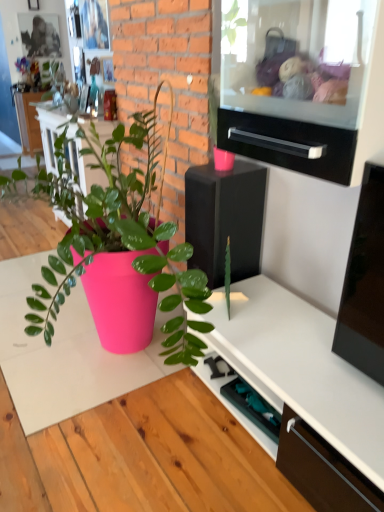
The height and width of the screenshot is (512, 384). What do you see at coordinates (225, 219) in the screenshot? I see `black glossy speaker at center` at bounding box center [225, 219].

Locate an element on the screen. black glossy speaker at center is located at coordinates (225, 219).

Describe the element at coordinates (289, 144) in the screenshot. I see `black glossy drawer at upper center` at that location.

The image size is (384, 512). What are the coordinates of `black glossy drawer at upper center` in the screenshot? It's located at (289, 144).

Identify the location of black glossy speaker at center. (225, 219).

Visually, is black glossy speaker at center positioned to the left or to the right of black glossy drawer at upper center?

black glossy speaker at center is positioned on black glossy drawer at upper center's left side.

Who is more distant, black glossy speaker at center or black glossy drawer at upper center?

black glossy speaker at center is more distant.

Is point (197, 191) closer to camera compared to point (306, 137)?

No, (197, 191) is behind (306, 137).

From the image's perspective, is black glossy speaker at center located above or below black glossy drawer at upper center?

Clearly, from the image's perspective, black glossy speaker at center is below black glossy drawer at upper center.

From a real-world perspective, is black glossy speaker at center on top of black glossy drawer at upper center?

No, from a real-world perspective, black glossy speaker at center is not on top of black glossy drawer at upper center.

Is black glossy speaker at center wider or thinner than black glossy drawer at upper center?

black glossy speaker at center is wider than black glossy drawer at upper center.

Who is taller, black glossy speaker at center or black glossy drawer at upper center?

Standing taller between the two is black glossy speaker at center.

Considering the sizes of black glossy speaker at center and black glossy drawer at upper center in the image, is black glossy speaker at center bigger or smaller than black glossy drawer at upper center?

In the image, black glossy speaker at center appears to be larger than black glossy drawer at upper center.

Is black glossy drawer at upper center a part of black glossy speaker at center?

No.

Are black glossy speaker at center and black glossy drawer at upper center making contact?

They are not placed beside each other.

Does black glossy speaker at center turn towards black glossy drawer at upper center?

No, black glossy speaker at center does not turn towards black glossy drawer at upper center.

Where is `drawer in front of the black glossy speaker at center`? The image size is (384, 512). drawer in front of the black glossy speaker at center is located at coordinates (289, 144).

Which object is positioned more to the left, black glossy drawer at upper center or black glossy speaker at center?

black glossy speaker at center is more to the left.

Between black glossy drawer at upper center and black glossy speaker at center, which one is positioned behind?

black glossy speaker at center.

Which is closer, (244, 151) or (248, 256)?

Point (244, 151) is closer to the camera than point (248, 256).

In the scene shown: From the image's perspective, is black glossy drawer at upper center below black glossy speaker at center?

No, from the image's perspective, black glossy drawer at upper center is not below black glossy speaker at center.

From a real-world perspective, who is located higher, black glossy drawer at upper center or black glossy speaker at center?

black glossy drawer at upper center.

Which of these two, black glossy drawer at upper center or black glossy speaker at center, is thinner?

Thinner between the two is black glossy drawer at upper center.

Considering the sizes of black glossy drawer at upper center and black glossy speaker at center in the image, is black glossy drawer at upper center taller or shorter than black glossy speaker at center?

Clearly, black glossy drawer at upper center is shorter compared to black glossy speaker at center.

Is black glossy drawer at upper center bigger or smaller than black glossy speaker at center?

In the image, black glossy drawer at upper center appears to be smaller than black glossy speaker at center.

Could black glossy speaker at center be considered to be inside black glossy drawer at upper center?

No.

Looking at this image, are black glossy drawer at upper center and black glossy speaker at center beside each other?

No, black glossy drawer at upper center is not touching black glossy speaker at center.

Is black glossy drawer at upper center positioned with its back to black glossy speaker at center?

No.

What are the coordinates of `appliance on the left of black glossy drawer at upper center` in the screenshot? It's located at (225, 219).

The image size is (384, 512). What are the coordinates of `appliance below the black glossy drawer at upper center (from the image's perspective)` in the screenshot? It's located at (225, 219).

The width and height of the screenshot is (384, 512). I want to click on drawer above the black glossy speaker at center (from a real-world perspective), so click(289, 144).